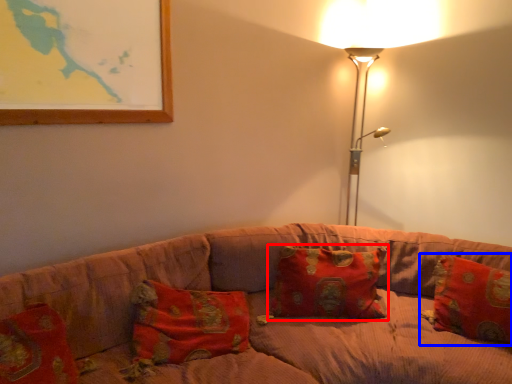
Question: Which object is further to the camera taking this photo, pillow (highlighted by a red box) or pillow (highlighted by a blue box)?

Choices:
 (A) pillow
 (B) pillow

Answer: (A)